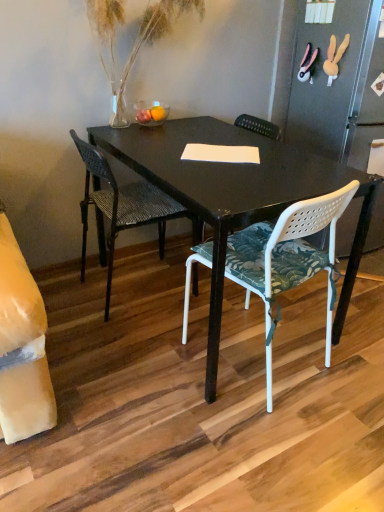
Question: From a real-world perspective, does white plastic chair with floral cushion at center, which ranks as the second chair in left-to-right order, stand above black woven chair at center, the 2th chair viewed from the right?

Choices:
 (A) yes
 (B) no

Answer: (A)

Question: Is white plastic chair with floral cushion at center, which ranks as the second chair in left-to-right order, facing towards black woven chair at center, the 2th chair viewed from the right?

Choices:
 (A) yes
 (B) no

Answer: (A)

Question: Is white plastic chair with floral cushion at center, which ranks as the second chair in left-to-right order, positioned with its back to black woven chair at center, the 2th chair viewed from the right?

Choices:
 (A) yes
 (B) no

Answer: (B)

Question: Is white plastic chair with floral cushion at center, which ranks as the second chair in left-to-right order, behind black woven chair at center, the 2th chair viewed from the right?

Choices:
 (A) no
 (B) yes

Answer: (A)

Question: Is white plastic chair with floral cushion at center, which ranks as the second chair in left-to-right order, thinner than black woven chair at center, the 2th chair viewed from the right?

Choices:
 (A) yes
 (B) no

Answer: (B)

Question: From the image's perspective, is white plastic chair with floral cushion at center, which ranks as the second chair in left-to-right order, under black woven chair at center, placed as the 1th chair when sorted from left to right?

Choices:
 (A) no
 (B) yes

Answer: (B)

Question: Could you tell me if black woven chair at center, placed as the 1th chair when sorted from left to right, is turned towards white plastic chair with floral cushion at center, which ranks as the second chair in left-to-right order?

Choices:
 (A) yes
 (B) no

Answer: (B)

Question: Is the position of black woven chair at center, the 2th chair viewed from the right, more distant than that of white plastic chair with floral cushion at center, which appears as the 1th chair when viewed from the right?

Choices:
 (A) no
 (B) yes

Answer: (B)

Question: From a real-world perspective, is black woven chair at center, placed as the 1th chair when sorted from left to right, located higher than white plastic chair with floral cushion at center, which appears as the 1th chair when viewed from the right?

Choices:
 (A) yes
 (B) no

Answer: (B)

Question: Is black woven chair at center, placed as the 1th chair when sorted from left to right, bigger than white plastic chair with floral cushion at center, which ranks as the second chair in left-to-right order?

Choices:
 (A) no
 (B) yes

Answer: (A)

Question: Is black woven chair at center, the 2th chair viewed from the right, looking in the opposite direction of white plastic chair with floral cushion at center, which appears as the 1th chair when viewed from the right?

Choices:
 (A) no
 (B) yes

Answer: (A)

Question: Is black woven chair at center, the 2th chair viewed from the right, to the left of white plastic chair with floral cushion at center, which appears as the 1th chair when viewed from the right, from the viewer's perspective?

Choices:
 (A) no
 (B) yes

Answer: (B)

Question: Considering the positions of white plastic chair with floral cushion at center, which appears as the 1th chair when viewed from the right, and black woven chair at center, the 2th chair viewed from the right, in the image, is white plastic chair with floral cushion at center, which appears as the 1th chair when viewed from the right, taller or shorter than black woven chair at center, the 2th chair viewed from the right,?

Choices:
 (A) short
 (B) tall

Answer: (A)